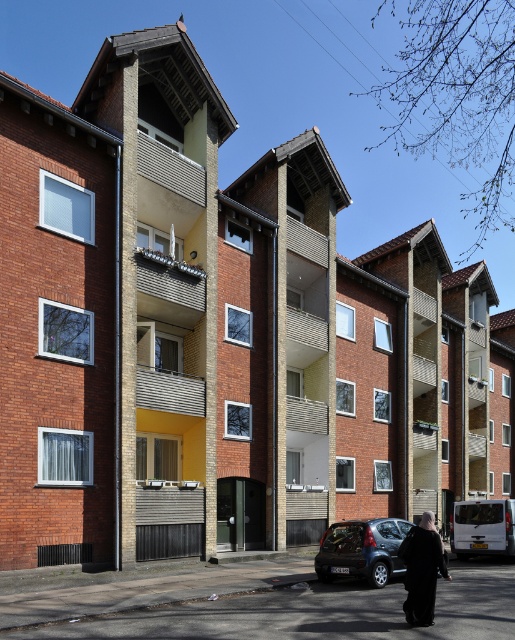
Is point (364, 572) positioned in front of point (443, 573)?

No, it is not.

Is dark gray metallic hatchback at lower center taller than black matte coat at lower center?

Incorrect, dark gray metallic hatchback at lower center's height is not larger of black matte coat at lower center's.

The height and width of the screenshot is (640, 515). I want to click on dark gray metallic hatchback at lower center, so click(x=362, y=548).

The height and width of the screenshot is (640, 515). Identify the location of dark gray metallic hatchback at lower center. (362, 548).